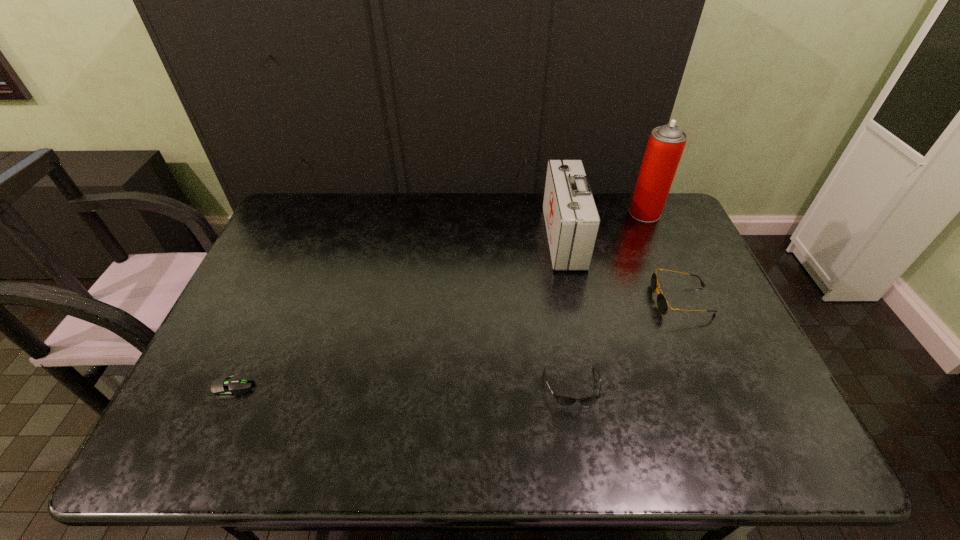
Locate an element on the screen. Image resolution: width=960 pixels, height=540 pixels. free spot between the third farthest object and the shortest object is located at coordinates (458, 343).

Locate an element on the screen. The image size is (960, 540). unoccupied position between the first-aid kit and the shortest object is located at coordinates (398, 312).

This screenshot has height=540, width=960. I want to click on empty space between the aerosol can and the second shortest object, so click(609, 301).

At what (x,y) coordinates should I click in order to perform the action: click on empty space between the shorter sunglasses and the aerosol can. Please return your answer as a coordinate pair (x, y). Looking at the image, I should click on (609, 301).

Where is `free space between the right sunglasses and the leftmost object`? free space between the right sunglasses and the leftmost object is located at coordinates (458, 343).

Locate an element on the screen. The height and width of the screenshot is (540, 960). vacant point located between the computer mouse and the aerosol can is located at coordinates (440, 300).

What are the coordinates of `vacant point located between the nearer sunglasses and the right sunglasses` in the screenshot? It's located at (627, 344).

Where is `object that is the second closest to the shorter sunglasses`? This screenshot has width=960, height=540. object that is the second closest to the shorter sunglasses is located at coordinates (572, 221).

Image resolution: width=960 pixels, height=540 pixels. Identify the location of object that stands as the second closest to the fourth shortest object. (666, 144).

Identify the location of free point that satisfies the following two spatial constraints: 1. on the front-facing side of the second tallest object; 2. on the front-facing side of the fourth tallest object. (595, 388).